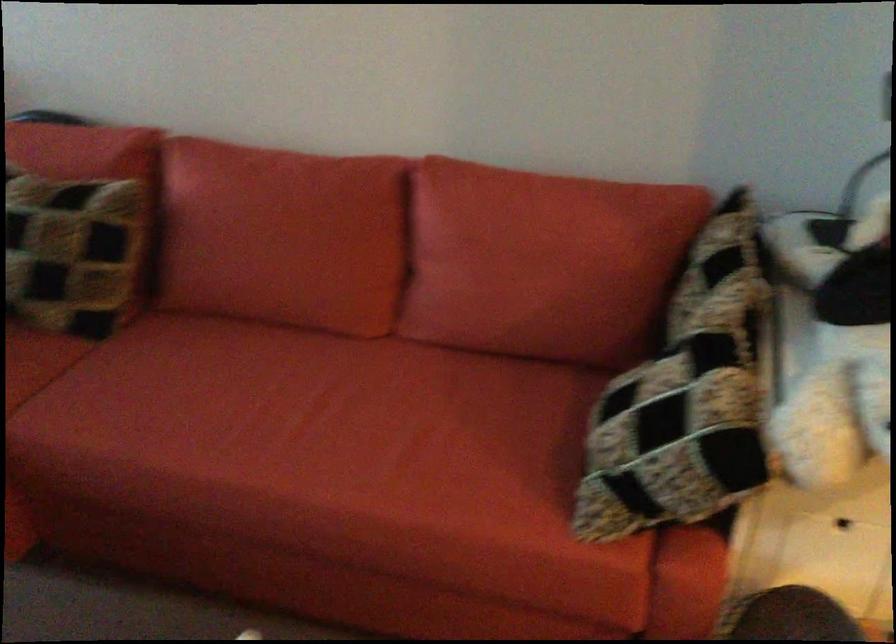
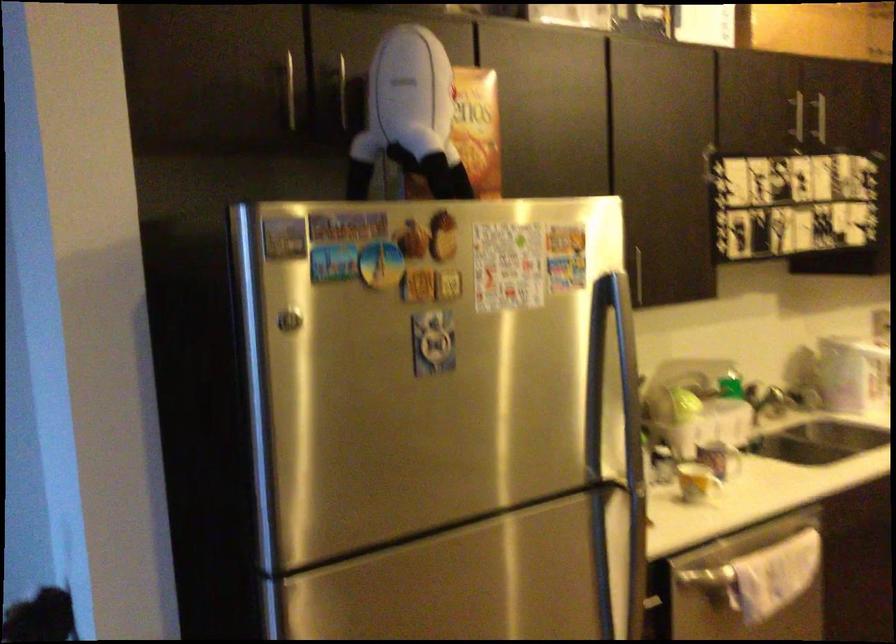
Question: The camera is either moving clockwise (left) or counter-clockwise (right) around the object. The first image is from the beginning of the video and the second image is from the end. Is the camera moving left or right when shooting the video?

Choices:
 (A) Left
 (B) Right

Answer: (A)